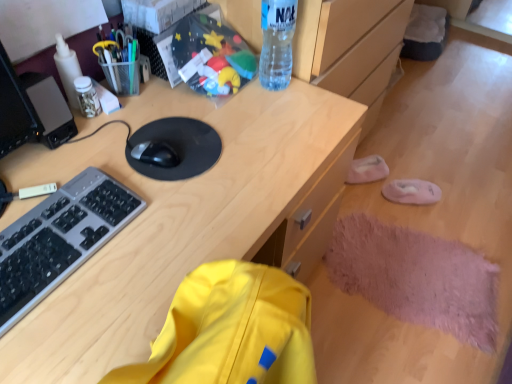
Locate an element on the screen. empty space that is ontop of gray plastic keyboard at left is located at coordinates (51, 225).